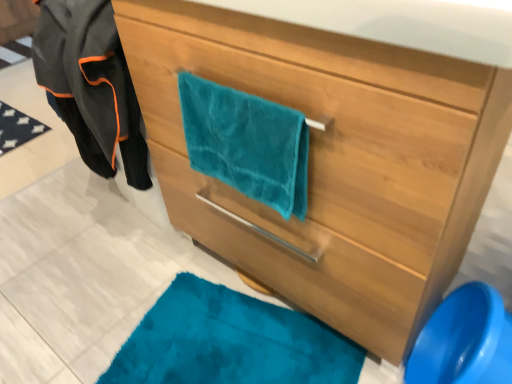
Question: Is teal fabric at lower right not inside teal plush towel at center?

Choices:
 (A) no
 (B) yes

Answer: (B)

Question: From a real-world perspective, is teal fabric at lower right over teal plush towel at center?

Choices:
 (A) yes
 (B) no

Answer: (B)

Question: From a real-world perspective, is teal fabric at lower right beneath teal plush towel at center?

Choices:
 (A) no
 (B) yes

Answer: (B)

Question: Can you confirm if teal fabric at lower right is positioned to the left of teal plush towel at center?

Choices:
 (A) yes
 (B) no

Answer: (B)

Question: Is teal fabric at lower right surrounding teal plush towel at center?

Choices:
 (A) no
 (B) yes

Answer: (A)

Question: From a real-world perspective, relative to velvet black jacket at left, is teal fabric towel at center vertically above or below?

Choices:
 (A) below
 (B) above

Answer: (A)

Question: From the image's perspective, is teal fabric towel at center above or below velvet black jacket at left?

Choices:
 (A) above
 (B) below

Answer: (B)

Question: Is teal fabric towel at center taller or shorter than velvet black jacket at left?

Choices:
 (A) short
 (B) tall

Answer: (B)

Question: Is point (253, 205) closer or farther from the camera than point (94, 8)?

Choices:
 (A) closer
 (B) farther

Answer: (A)

Question: From the image's perspective, relative to teal fabric at lower right, is teal plush towel at center above or below?

Choices:
 (A) below
 (B) above

Answer: (B)

Question: From a real-world perspective, relative to teal fabric at lower right, is teal plush towel at center vertically above or below?

Choices:
 (A) below
 (B) above

Answer: (B)

Question: Do you think teal plush towel at center is within teal fabric at lower right, or outside of it?

Choices:
 (A) inside
 (B) outside

Answer: (B)

Question: Considering the positions of teal plush towel at center and teal fabric at lower right in the image, is teal plush towel at center taller or shorter than teal fabric at lower right?

Choices:
 (A) short
 (B) tall

Answer: (A)

Question: Considering the positions of teal fabric at lower right and teal fabric towel at center in the image, is teal fabric at lower right taller or shorter than teal fabric towel at center?

Choices:
 (A) tall
 (B) short

Answer: (A)

Question: From a real-world perspective, is teal fabric at lower right above or below teal fabric towel at center?

Choices:
 (A) below
 (B) above

Answer: (B)